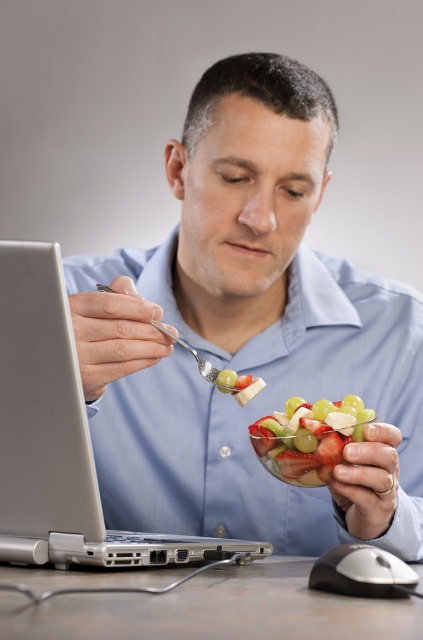
You are a drone flying above the desk in the scene. You need to land at one of the two points, point A at point (313, 490) or point B at point (310, 456). Which point should you choose to land closer to the viewer?

Point A at point (313, 490) is closer to the viewer than point B at point (310, 456), so you should choose point A to land closer to the viewer.

You are a delivery robot trying to navigate to the desk. You see two points marked in the image. Which point is closer to you, point (316,424) or point (376,570)?

Point (316,424) is closer to you because it is further to the viewer than point (376,570).

What are the coordinates of the blue matte shirt at center?

The blue matte shirt at center is located at coordinates (247, 333).